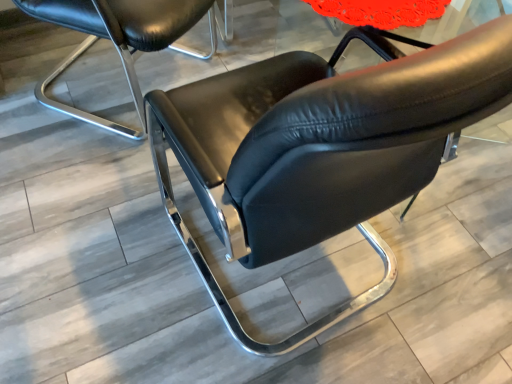
Question: Considering the positions of point (300, 72) and point (91, 19), is point (300, 72) closer or farther from the camera than point (91, 19)?

Choices:
 (A) farther
 (B) closer

Answer: (B)

Question: Choose the correct answer: Is black leather chair at center, the 2th chair positioned from the left, inside matte black chair at center, which is the 2th chair from right to left, or outside it?

Choices:
 (A) outside
 (B) inside

Answer: (A)

Question: Based on their sizes in the image, would you say black leather chair at center, placed as the first chair when sorted from right to left, is bigger or smaller than matte black chair at center, which is the 2th chair from right to left?

Choices:
 (A) small
 (B) big

Answer: (B)

Question: Is matte black chair at center, the 1th chair viewed from the left, taller or shorter than black leather chair at center, placed as the first chair when sorted from right to left?

Choices:
 (A) tall
 (B) short

Answer: (B)

Question: From a real-world perspective, is matte black chair at center, the 1th chair viewed from the left, positioned above or below black leather chair at center, the 2th chair positioned from the left?

Choices:
 (A) above
 (B) below

Answer: (B)

Question: Relative to black leather chair at center, the 2th chair positioned from the left, is matte black chair at center, which is the 2th chair from right to left, in front or behind?

Choices:
 (A) behind
 (B) front

Answer: (A)

Question: Considering the positions of point (96, 11) and point (243, 249), is point (96, 11) closer or farther from the camera than point (243, 249)?

Choices:
 (A) farther
 (B) closer

Answer: (A)